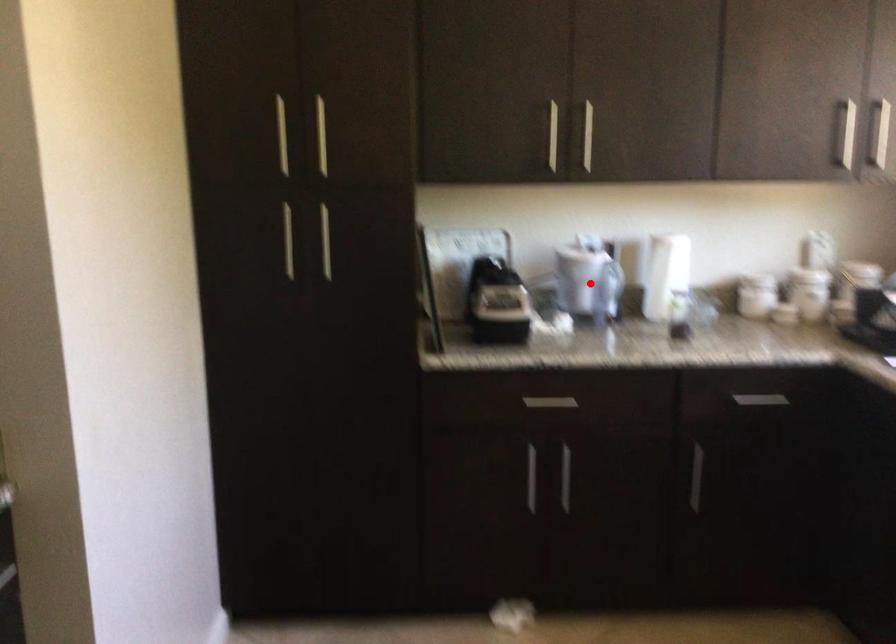
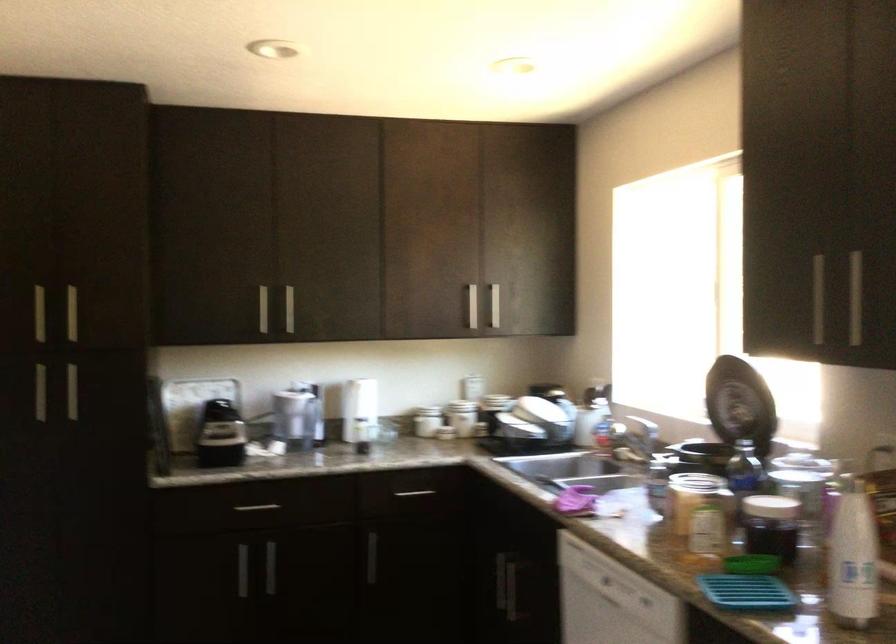
Question: I am providing you with two images of the same scene from different viewpoints. Image1 has a red point marked. In image2, the corresponding 3D location appears at what relative position? Reply with the corresponding letter.

Choices:
 (A) Closer
 (B) Farther

Answer: (B)